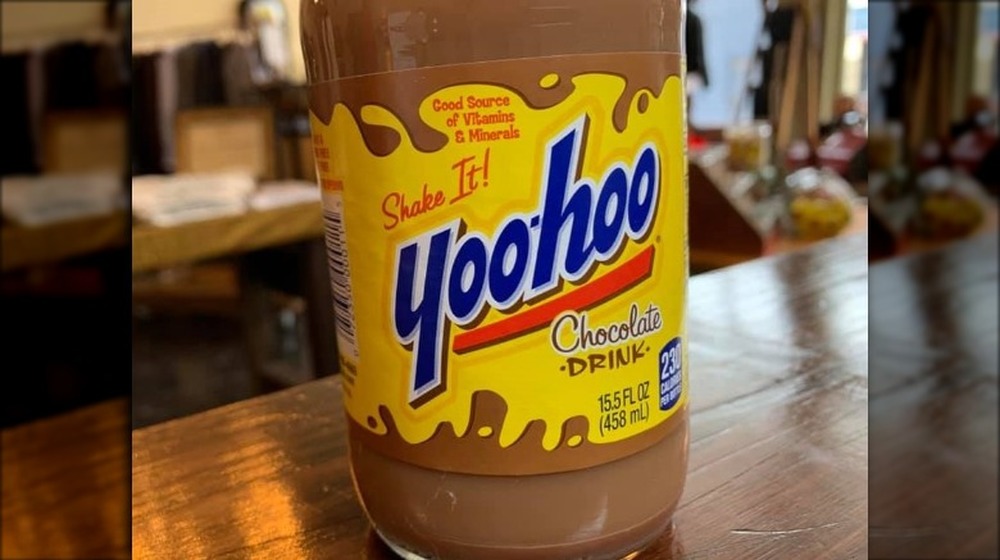
Locate an element on the screen. This screenshot has width=1000, height=560. wooden tabletop is located at coordinates 763,316.